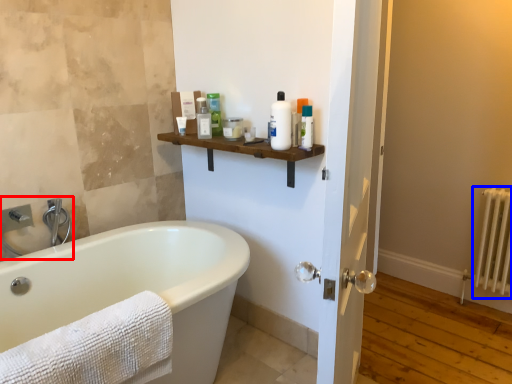
Question: Which point is closer to the camera, sink (highlighted by a red box) or radiator (highlighted by a blue box)?

Choices:
 (A) sink
 (B) radiator

Answer: (A)